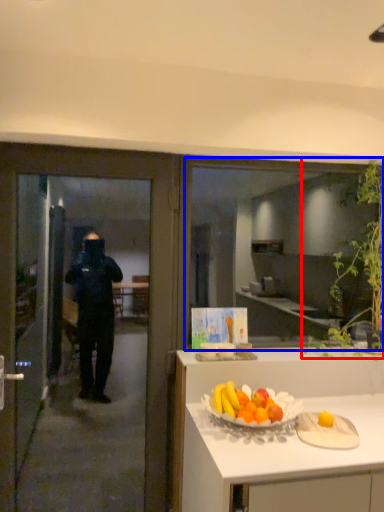
Question: Which of the following is the farthest to the observer, plant (highlighted by a red box) or window (highlighted by a blue box)?

Choices:
 (A) plant
 (B) window

Answer: (B)